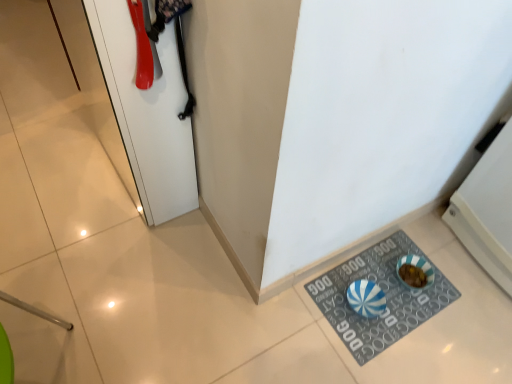
Where is `vacant area situated below white glossy door at upper left (from a real-world perspective)`? The image size is (512, 384). vacant area situated below white glossy door at upper left (from a real-world perspective) is located at coordinates (121, 170).